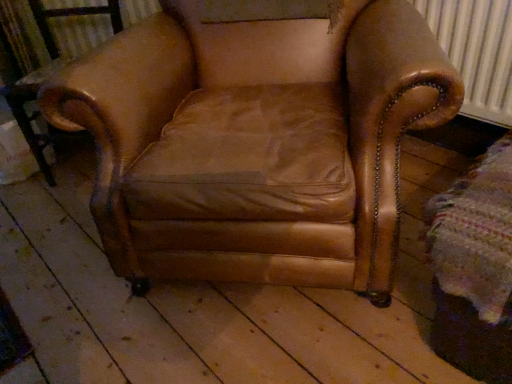
Where is `metallic black side table at left`? metallic black side table at left is located at coordinates click(34, 112).

What do you see at coordinates (34, 112) in the screenshot? I see `metallic black side table at left` at bounding box center [34, 112].

Measure the distance between point (x=57, y=136) and camera.

A distance of 5.57 feet exists between point (x=57, y=136) and camera.

What do you see at coordinates (256, 139) in the screenshot?
I see `leather armchair at center` at bounding box center [256, 139].

Find the location of a particular element. The width and height of the screenshot is (512, 384). leather armchair at center is located at coordinates (256, 139).

Where is `metallic black side table at left`? This screenshot has width=512, height=384. metallic black side table at left is located at coordinates (34, 112).

In the scene shown: Can you confirm if leather armchair at center is positioned to the left of metallic black side table at left?

Incorrect, leather armchair at center is not on the left side of metallic black side table at left.

Is leather armchair at center positioned in front of metallic black side table at left?

That is True.

Considering the positions of points (102, 114) and (39, 139), is point (102, 114) closer to camera compared to point (39, 139)?

Yes, point (102, 114) is in front of point (39, 139).

From the image's perspective, which object appears higher, leather armchair at center or metallic black side table at left?

leather armchair at center appears higher in the image.

From a real-world perspective, is leather armchair at center positioned above or below metallic black side table at left?

leather armchair at center is above metallic black side table at left.

Can you confirm if leather armchair at center is thinner than metallic black side table at left?

In fact, leather armchair at center might be wider than metallic black side table at left.

Can you confirm if leather armchair at center is taller than metallic black side table at left?

Yes, leather armchair at center is taller than metallic black side table at left.

Can you confirm if leather armchair at center is bigger than metallic black side table at left?

Yes.

Choose the correct answer: Is leather armchair at center inside metallic black side table at left or outside it?

leather armchair at center exists outside the volume of metallic black side table at left.

Is leather armchair at center placed right next to metallic black side table at left?

No, leather armchair at center is not in contact with metallic black side table at left.

Is leather armchair at center oriented towards metallic black side table at left?

No, leather armchair at center is not aimed at metallic black side table at left.

Identify the location of chair in front of the metallic black side table at left. The height and width of the screenshot is (384, 512). (256, 139).

Consider the image. Is metallic black side table at left to the right of leather armchair at center from the viewer's perspective?

In fact, metallic black side table at left is to the left of leather armchair at center.

Does metallic black side table at left come in front of leather armchair at center?

No, metallic black side table at left is further to the viewer.

Is point (13, 109) closer to viewer compared to point (149, 140)?

No, it is behind (149, 140).

Based on the photo, from the image's perspective, relative to leather armchair at center, is metallic black side table at left above or below?

metallic black side table at left is situated lower than leather armchair at center in the image.

From a real-world perspective, which object stands above the other?

leather armchair at center.

Is metallic black side table at left thinner than leather armchair at center?

Indeed, metallic black side table at left has a lesser width compared to leather armchair at center.

Between metallic black side table at left and leather armchair at center, which one has more height?

leather armchair at center is taller.

Does metallic black side table at left have a larger size compared to leather armchair at center?

No, metallic black side table at left is not bigger than leather armchair at center.

Is leather armchair at center inside metallic black side table at left?

No, leather armchair at center is not a part of metallic black side table at left.

In the scene shown: Would you consider metallic black side table at left to be distant from leather armchair at center?

metallic black side table at left is actually quite close to leather armchair at center.

Is metallic black side table at left positioned with its back to leather armchair at center?

No, leather armchair at center is not at the back of metallic black side table at left.

How many degrees apart are the facing directions of metallic black side table at left and leather armchair at center?

metallic black side table at left and leather armchair at center are facing 6.49 degrees away from each other.

You are a GUI agent. You are given a task and a screenshot of the screen. Output one action in this format:
    pyautogui.click(x=<x>, y=<y>)
    Task: Click on the side table below the leather armchair at center (from a real-world perspective)
    The width and height of the screenshot is (512, 384).
    Given the screenshot: What is the action you would take?
    pyautogui.click(x=34, y=112)

The width and height of the screenshot is (512, 384). Find the location of `side table behind the leather armchair at center`. side table behind the leather armchair at center is located at coordinates (34, 112).

Identify the location of chair that appears on the right of metallic black side table at left. Image resolution: width=512 pixels, height=384 pixels. (256, 139).